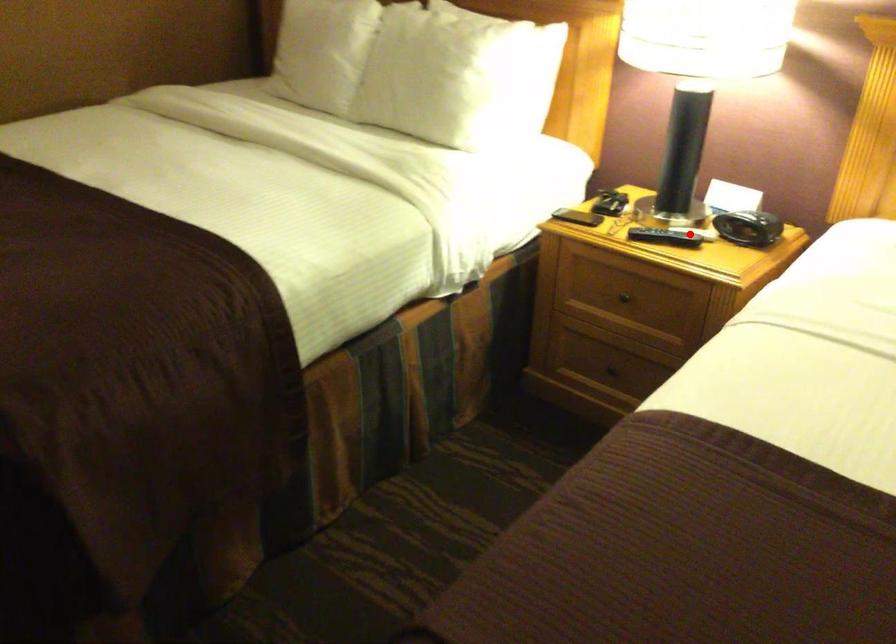
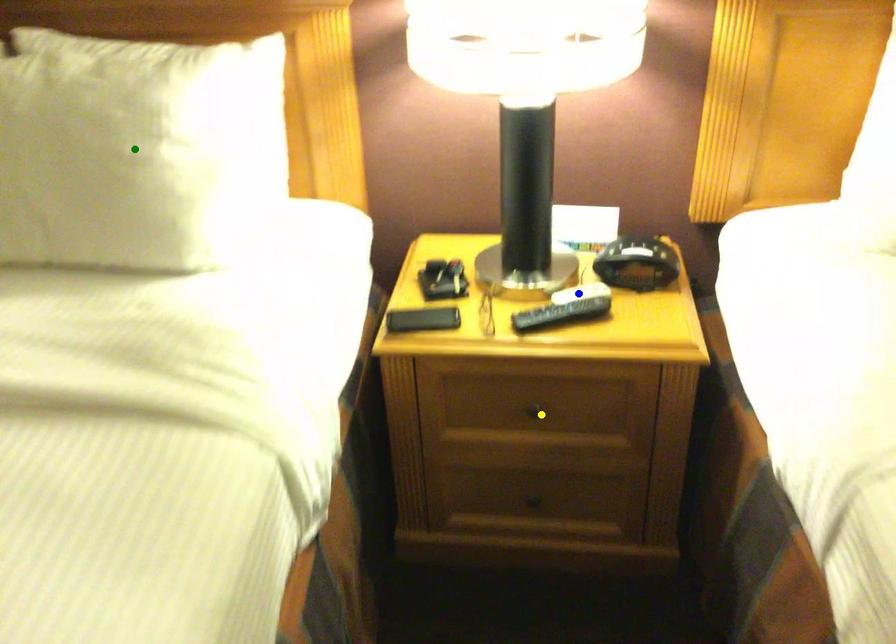
Question: I am providing you with two images of the same scene from different viewpoints. A red point is marked on the first image. You are given multiple points on the second image. Which point in image 2 is actually the same real-world point as the red point in image 1?

Choices:
 (A) green point
 (B) yellow point
 (C) blue point

Answer: (C)